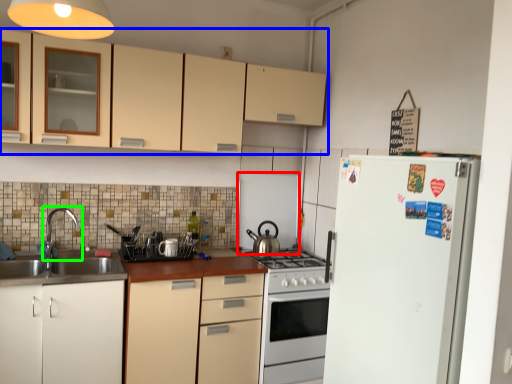
Question: Considering the real-world distances, which object is closest to appliance (highlighted by a red box)? cabinetry (highlighted by a blue box) or tap (highlighted by a green box).

Choices:
 (A) cabinetry
 (B) tap

Answer: (A)